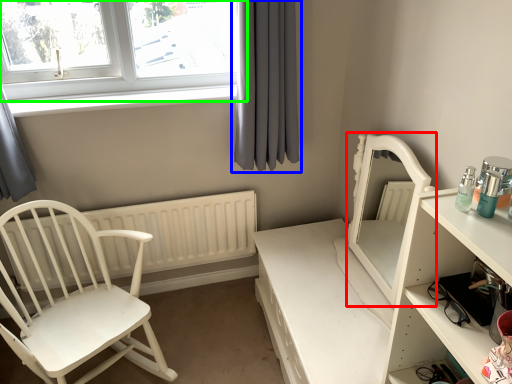
Question: Considering the real-world distances, which object is farthest from back (highlighted by a red box)? curtain (highlighted by a blue box) or window (highlighted by a green box)?

Choices:
 (A) curtain
 (B) window

Answer: (B)